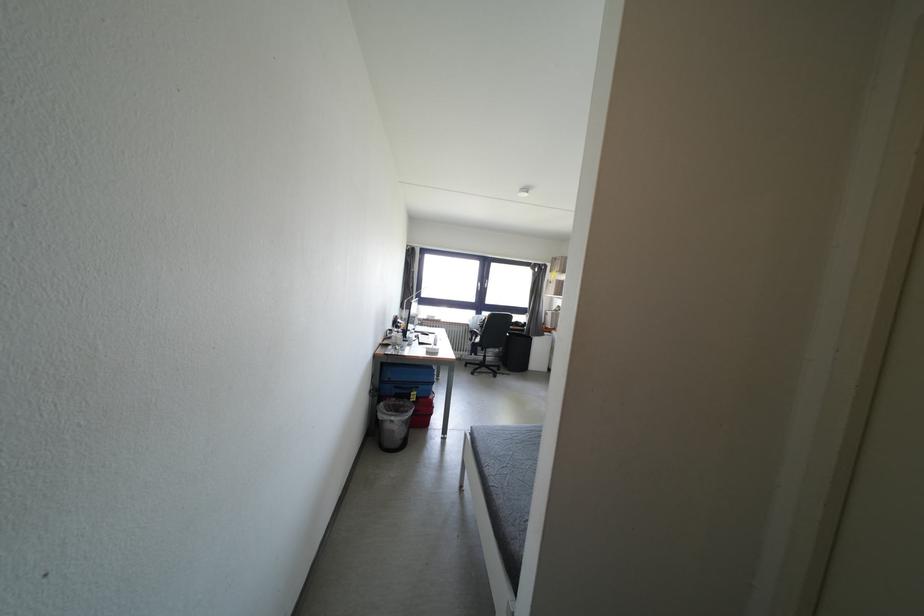
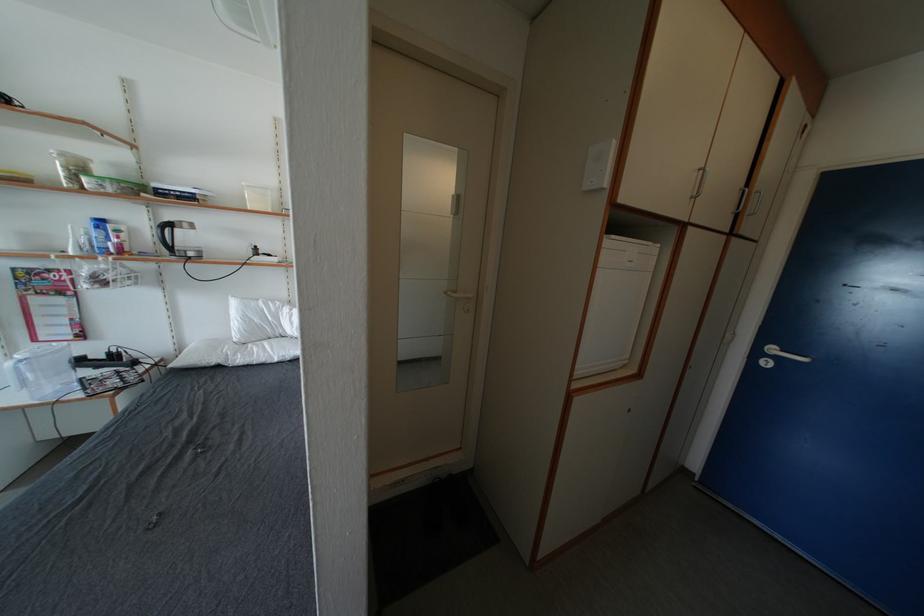
First-person continuous shooting, in which direction is the camera rotating?

The camera rotated toward right-down.